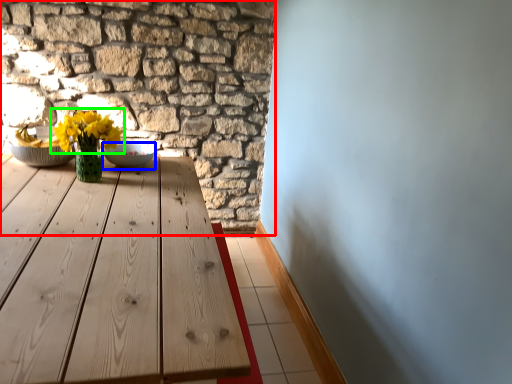
Question: Which object is the closest to the brickwork (highlighted by a red box)? Choose among these: bowl (highlighted by a blue box) or flower (highlighted by a green box).

Choices:
 (A) bowl
 (B) flower

Answer: (B)